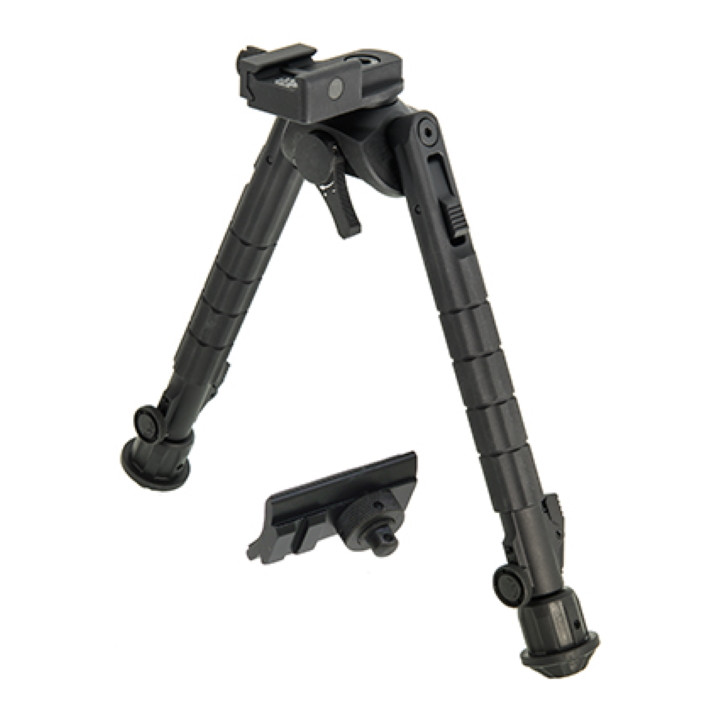
Locate an element on the screen. The height and width of the screenshot is (720, 720). switch is located at coordinates (338, 207).